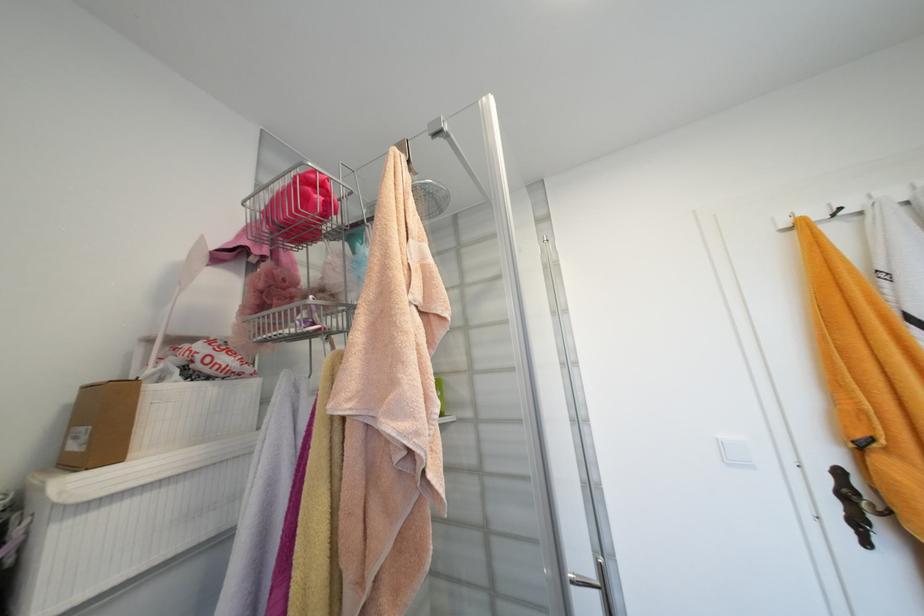
Image resolution: width=924 pixels, height=616 pixels. I want to click on white light switch, so click(x=736, y=451).